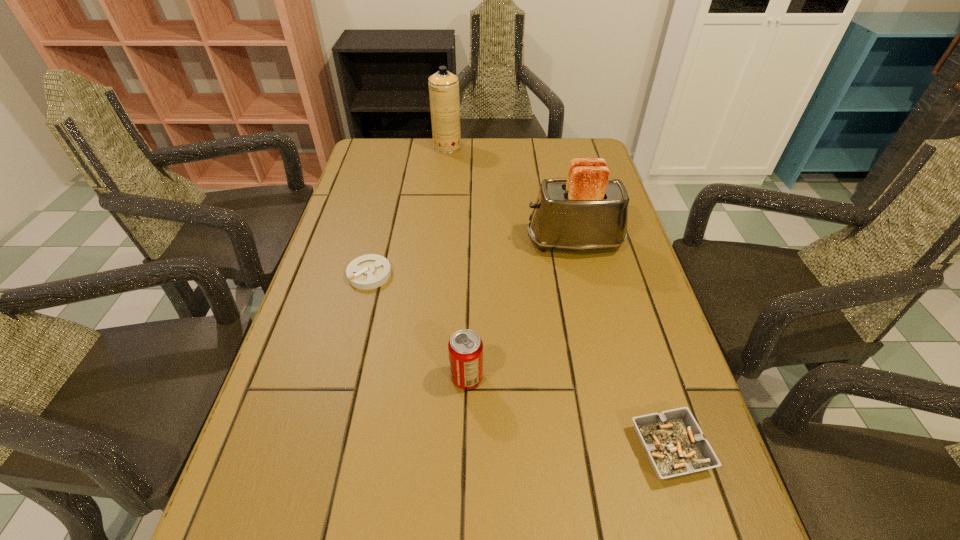
The image size is (960, 540). I want to click on vacant point that satisfies the following two spatial constraints: 1. on the front side of the farthest object; 2. on the right side of the nearer ashtray, so click(x=416, y=449).